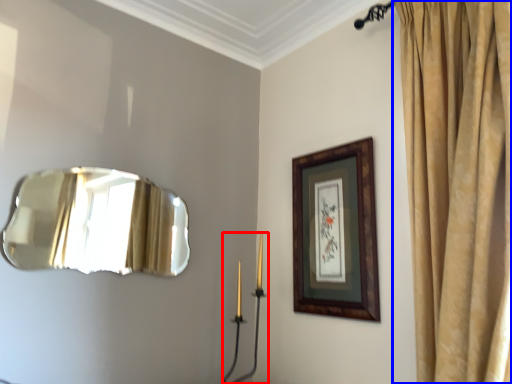
Question: Which object appears closest to the camera in this image, candle holder (highlighted by a red box) or curtain (highlighted by a blue box)?

Choices:
 (A) candle holder
 (B) curtain

Answer: (B)